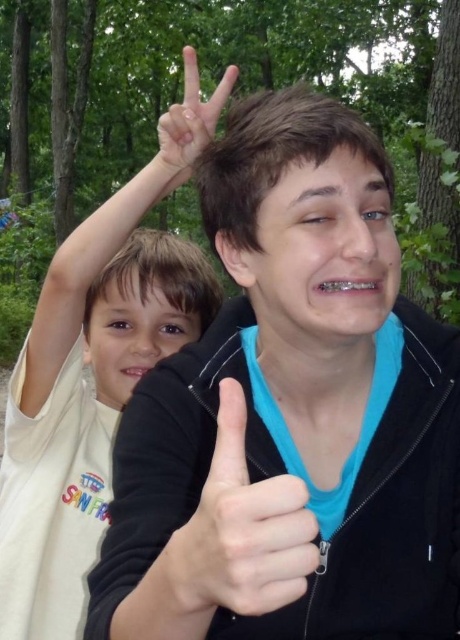
You are a photographer trying to capture a candid shot of both the smooth skin thumb up at center and the white matte hand at upper center in the image. Based on their positions, which hand gesture should you focus on first to ensure both are in frame?

The smooth skin thumb up at center is shorter than the white matte hand at upper center, so you should focus on the white matte hand at upper center first to ensure both are in frame.

You are a photographer trying to capture a closeup of the black matte jacket at center and the smooth skin thumb up at center in the scene. Given that your camera can only focus on objects within a 5 inch range, will both objects be in focus?

The black matte jacket at center is 7.99 inches away from smooth skin thumb up at center. Since the distance between them is greater than the 5 inch focus range, they cannot both be in focus simultaneously.

You are a photographer trying to capture a clear shot of both the light beige shirt at upper left and the white matte hand at upper center. Based on their positions, which object should you focus on first to ensure both are in focus?

The light beige shirt at upper left is closer to the viewer than the white matte hand at upper center, so you should focus on the light beige shirt at upper left first to ensure both are in focus.